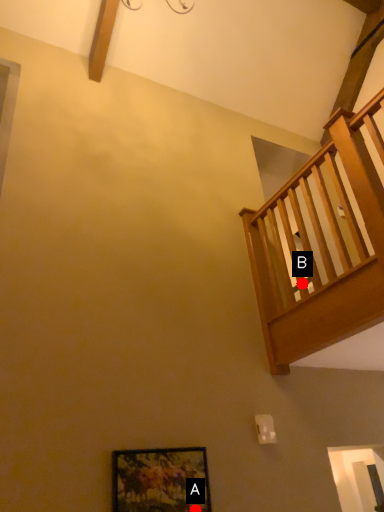
Question: Two points are circled on the image, labeled by A and B beside each circle. Which of the following is the closest to the observer?

Choices:
 (A) A is closer
 (B) B is closer

Answer: (A)